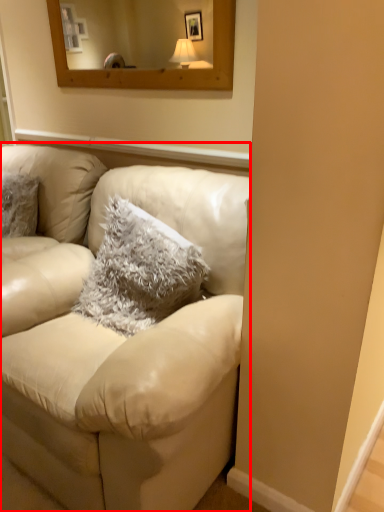
Question: Observing the image, what is the correct spatial positioning of studio couch (annotated by the red box) in reference to pillow?

Choices:
 (A) left
 (B) right

Answer: (A)